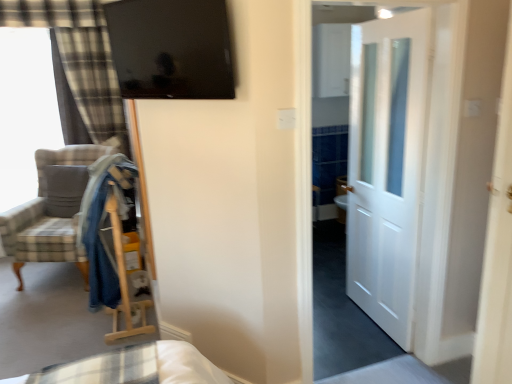
This screenshot has height=384, width=512. Describe the element at coordinates (64, 189) in the screenshot. I see `soft gray pillow at left` at that location.

Where is `white wooden door at center, the 1th door from the front`? This screenshot has width=512, height=384. white wooden door at center, the 1th door from the front is located at coordinates (498, 250).

This screenshot has width=512, height=384. I want to click on plaid fabric armchair at left, so click(51, 210).

Measure the distance between white glossy door at center, the first door positioned from the back, and camera.

The depth of white glossy door at center, the first door positioned from the back, is 2.10 meters.

Describe the element at coordinates (386, 166) in the screenshot. The width and height of the screenshot is (512, 384). I see `white glossy door at center, the first door positioned from the back` at that location.

Locate an element on the screen. This screenshot has height=384, width=512. soft gray pillow at left is located at coordinates (64, 189).

Is plaid fabric armchair at left oriented towards glossy black tv at upper center?

No, plaid fabric armchair at left does not turn towards glossy black tv at upper center.

From a real-world perspective, is plaid fabric armchair at left beneath glossy black tv at upper center?

Correct, in the physical world, plaid fabric armchair at left is lower than glossy black tv at upper center.

Is plaid fabric armchair at left not close to glossy black tv at upper center?

plaid fabric armchair at left is far away from glossy black tv at upper center.

Which of these two, plaid fabric armchair at left or glossy black tv at upper center, is smaller?

glossy black tv at upper center is smaller.

Is white wooden door at center, acting as the 2th door starting from the back, not within glossy black tv at upper center?

Indeed, white wooden door at center, acting as the 2th door starting from the back, is completely outside glossy black tv at upper center.

Does white wooden door at center, the 1th door from the front, have a lesser height compared to glossy black tv at upper center?

No, white wooden door at center, the 1th door from the front, is not shorter than glossy black tv at upper center.

Between white wooden door at center, acting as the 2th door starting from the back, and glossy black tv at upper center, which one appears on the left side from the viewer's perspective?

glossy black tv at upper center.

Is white glossy door at center, the first door positioned from the back, positioned before denim robe at left?

Yes, the depth of white glossy door at center, the first door positioned from the back, is less than that of denim robe at left.

Is white glossy door at center, which appears as the second door when viewed from the front, next to denim robe at left and touching it?

No.

Is white glossy door at center, the first door positioned from the back, bigger or smaller than denim robe at left?

In the image, white glossy door at center, the first door positioned from the back, appears to be larger than denim robe at left.

Considering the relative sizes of white wooden door at center, the 1th door from the front, and soft gray pillow at left in the image provided, is white wooden door at center, the 1th door from the front, taller than soft gray pillow at left?

Yes.

Is white wooden door at center, the 1th door from the front, aimed at soft gray pillow at left?

No, white wooden door at center, the 1th door from the front, is not facing towards soft gray pillow at left.

From a real-world perspective, is white wooden door at center, acting as the 2th door starting from the back, located higher than soft gray pillow at left?

Indeed, from a real-world perspective, white wooden door at center, acting as the 2th door starting from the back, stands above soft gray pillow at left.

Which object is wider, white wooden door at center, acting as the 2th door starting from the back, or soft gray pillow at left?

soft gray pillow at left.

Can you confirm if plaid fabric armchair at left is smaller than white wooden door at center, the 1th door from the front?

No, plaid fabric armchair at left is not smaller than white wooden door at center, the 1th door from the front.

This screenshot has height=384, width=512. I want to click on chair to the left of white wooden door at center, acting as the 2th door starting from the back, so click(x=51, y=210).

From a real-world perspective, between plaid fabric armchair at left and white wooden door at center, acting as the 2th door starting from the back, who is vertically higher?

white wooden door at center, acting as the 2th door starting from the back.

Looking at this image, is plaid fabric armchair at left turned away from white wooden door at center, acting as the 2th door starting from the back?

plaid fabric armchair at left does not have its back to white wooden door at center, acting as the 2th door starting from the back.

Is soft gray pillow at left at the left side of denim robe at left?

Correct, you'll find soft gray pillow at left to the left of denim robe at left.

Which is in front, point (78, 196) or point (96, 279)?

Positioned in front is point (96, 279).

Is the surface of soft gray pillow at left in direct contact with denim robe at left?

No, soft gray pillow at left is not beside denim robe at left.

From a real-world perspective, which object rests below the other?

soft gray pillow at left.

Where is `pillow behind the denim robe at left`? pillow behind the denim robe at left is located at coordinates (64, 189).

Is denim robe at left looking in the opposite direction of soft gray pillow at left?

No, denim robe at left is not facing the opposite direction of soft gray pillow at left.

In the scene shown: From a real-world perspective, between denim robe at left and soft gray pillow at left, who is vertically higher?

denim robe at left is physically above.

I want to click on chair beneath the glossy black tv at upper center (from a real-world perspective), so coord(51,210).

Identify the location of the 2nd door to the right of the glossy black tv at upper center, counting from the anchor's position. (498, 250).

Looking at the image, which one is located closer to plaid fabric armchair at left, white glossy door at center, the first door positioned from the back, or plaid fabric curtain at left?

plaid fabric curtain at left lies closer to plaid fabric armchair at left than the other object.

From the image, which object appears to be farther from plaid fabric armchair at left, plaid fabric curtain at left or soft gray pillow at left?

Based on the image, plaid fabric curtain at left appears to be further to plaid fabric armchair at left.

Looking at the image, which one is located closer to white glossy door at center, which appears as the second door when viewed from the front, glossy black tv at upper center or plaid fabric armchair at left?

glossy black tv at upper center lies closer to white glossy door at center, which appears as the second door when viewed from the front, than the other object.

When comparing their distances from plaid fabric armchair at left, does glossy black tv at upper center or white glossy door at center, which appears as the second door when viewed from the front, seem closer?

The object closer to plaid fabric armchair at left is glossy black tv at upper center.

Which object lies further to the anchor point denim robe at left, soft gray pillow at left or glossy black tv at upper center?

soft gray pillow at left is further to denim robe at left.

From the image, which object appears to be farther from plaid fabric armchair at left, white wooden door at center, the 1th door from the front, or denim robe at left?

white wooden door at center, the 1th door from the front, is further to plaid fabric armchair at left.

From the image, which object appears to be farther from denim robe at left, white glossy door at center, the first door positioned from the back, or plaid fabric curtain at left?

plaid fabric curtain at left is further to denim robe at left.

From the image, which object appears to be nearer to denim robe at left, white wooden door at center, acting as the 2th door starting from the back, or plaid fabric curtain at left?

plaid fabric curtain at left is positioned closer to the anchor denim robe at left.

This screenshot has width=512, height=384. In order to click on window screen between plaid fabric armchair at left and white glossy door at center, the first door positioned from the back, from left to right in this screenshot , I will do `click(172, 48)`.

The image size is (512, 384). Find the location of `robe between plaid fabric curtain at left and white glossy door at center, the first door positioned from the back, in the horizontal direction`. robe between plaid fabric curtain at left and white glossy door at center, the first door positioned from the back, in the horizontal direction is located at coordinates (103, 228).

Find the location of a particular element. Image resolution: width=512 pixels, height=384 pixels. door located between soft gray pillow at left and white wooden door at center, acting as the 2th door starting from the back, in the left-right direction is located at coordinates tap(386, 166).

Locate an element on the screen. This screenshot has height=384, width=512. window screen located between plaid fabric curtain at left and white glossy door at center, which appears as the second door when viewed from the front, in the left-right direction is located at coordinates (172, 48).